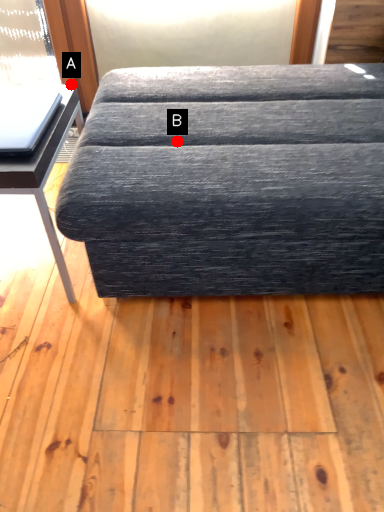
Question: Two points are circled on the image, labeled by A and B beside each circle. Which point appears closest to the camera in this image?

Choices:
 (A) A is closer
 (B) B is closer

Answer: (B)